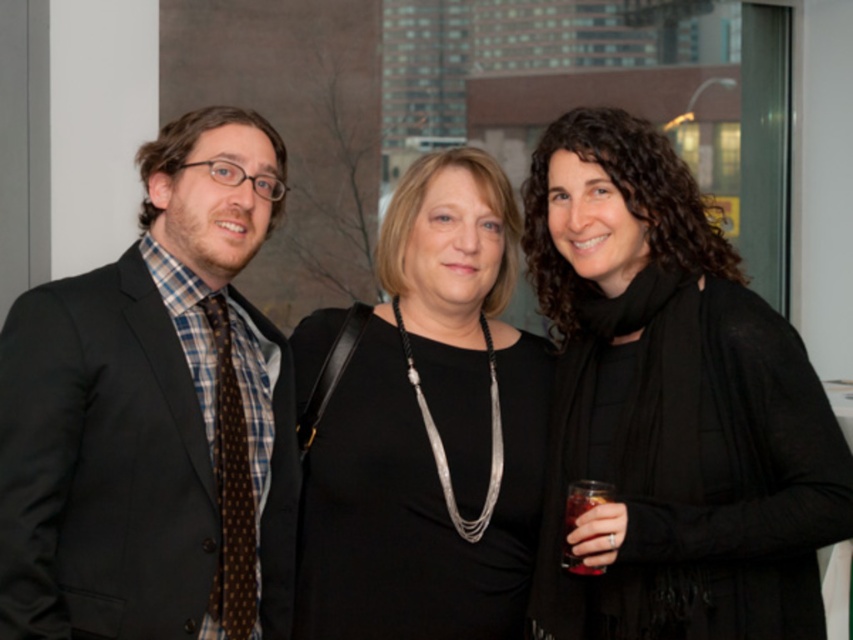
Which is more to the right, matte black suit at left or black matte dress at center?

Positioned to the right is black matte dress at center.

Consider the image. Between matte black suit at left and black matte dress at center, which one is positioned lower?

black matte dress at center

Does point (173, 451) come behind point (498, 595)?

No, it is in front of (498, 595).

Find the location of a particular element. matte black suit at left is located at coordinates (154, 417).

Can you confirm if black sheer scarf at center is bigger than matte black suit at left?

Indeed, black sheer scarf at center has a larger size compared to matte black suit at left.

How much distance is there between black sheer scarf at center and matte black suit at left?

black sheer scarf at center is 34.34 inches away from matte black suit at left.

Is point (636, 589) closer to camera compared to point (190, 509)?

That is False.

Find the location of a particular element. This screenshot has height=640, width=853. black sheer scarf at center is located at coordinates (672, 404).

Is black sheer scarf at center shorter than black matte dress at center?

No.

Does black sheer scarf at center appear on the left side of black matte dress at center?

In fact, black sheer scarf at center is to the right of black matte dress at center.

Does point (548, 307) come closer to viewer compared to point (364, 369)?

No, it is behind (364, 369).

The height and width of the screenshot is (640, 853). Identify the location of black sheer scarf at center. (672, 404).